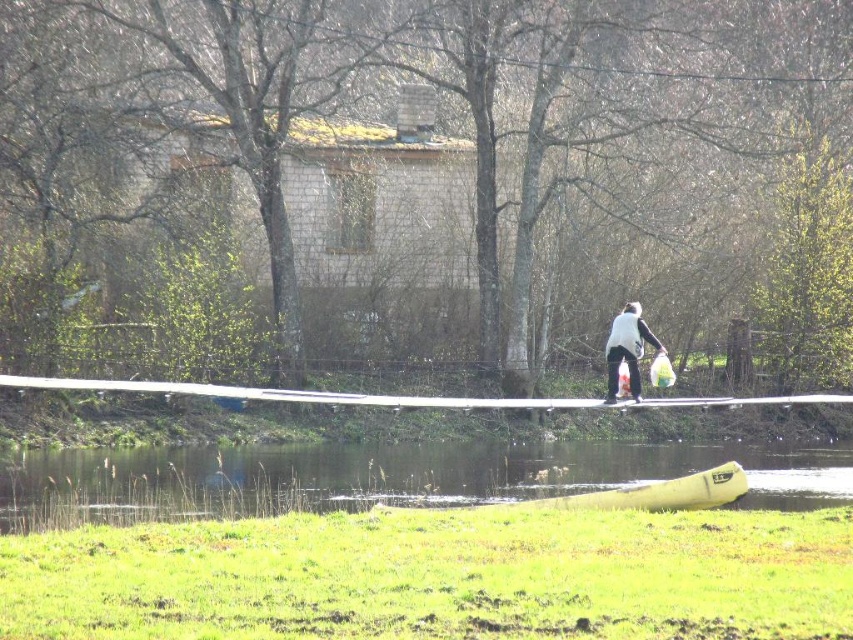
Question: Is green grass at lower center bigger than white matte vest at center?

Choices:
 (A) yes
 (B) no

Answer: (A)

Question: Does green grass at lower center appear on the left side of white matte vest at center?

Choices:
 (A) no
 (B) yes

Answer: (B)

Question: Among these objects, which one is farthest from the camera?

Choices:
 (A) green grass at lower center
 (B) white matte vest at center

Answer: (B)

Question: Is green grass at lower center above white matte vest at center?

Choices:
 (A) yes
 (B) no

Answer: (B)